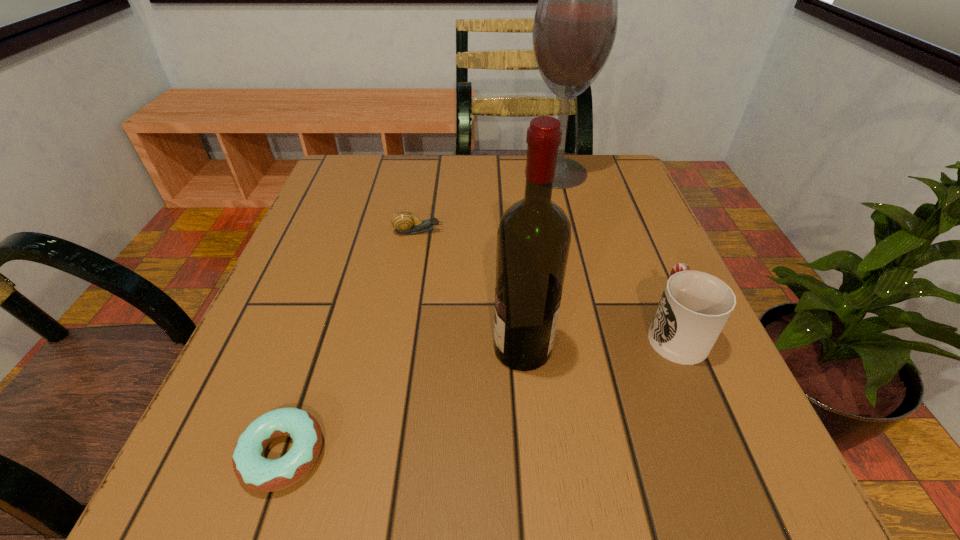
Where is `vacant space at the far right corner of the desktop`? vacant space at the far right corner of the desktop is located at coordinates (606, 194).

Find the location of a particular element. free space between the farther alcohol and the leftmost object is located at coordinates (420, 313).

You are a GUI agent. You are given a task and a screenshot of the screen. Output one action in this format:
    pyautogui.click(x=<x>, y=<y>)
    Task: Click on the vacant area between the shortest object and the nearer alcohol
    The height and width of the screenshot is (540, 960).
    Given the screenshot: What is the action you would take?
    pyautogui.click(x=403, y=401)

This screenshot has width=960, height=540. I want to click on vacant space that's between the second farthest object and the nearer alcohol, so click(x=470, y=290).

You are a GUI agent. You are given a task and a screenshot of the screen. Output one action in this format:
    pyautogui.click(x=<x>, y=<y>)
    Task: Click on the free spot between the nearest object and the third shortest object
    The height and width of the screenshot is (540, 960).
    Given the screenshot: What is the action you would take?
    pyautogui.click(x=478, y=393)

Identify the location of free area in between the nearer alcohol and the leftmost object. (403, 401).

What are the coordinates of `vacant area between the doughnut and the farthest object` in the screenshot? It's located at (420, 313).

Where is `free spot between the rightmost object and the leftmost object`? The width and height of the screenshot is (960, 540). free spot between the rightmost object and the leftmost object is located at coordinates (478, 393).

This screenshot has width=960, height=540. Identify the location of empty location between the fourth tallest object and the leftmost object. (350, 343).

Identify the location of free space between the farthest object and the second farthest object. (487, 202).